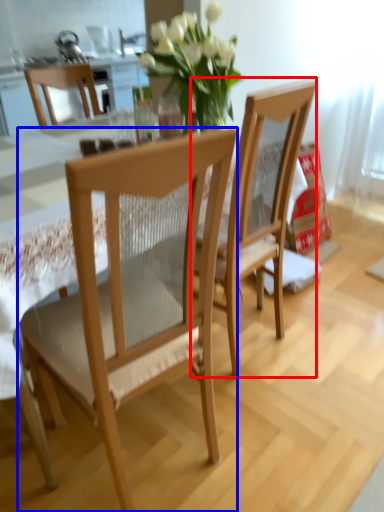
Question: Among these objects, which one is farthest to the camera, chair (highlighted by a red box) or chair (highlighted by a blue box)?

Choices:
 (A) chair
 (B) chair

Answer: (A)